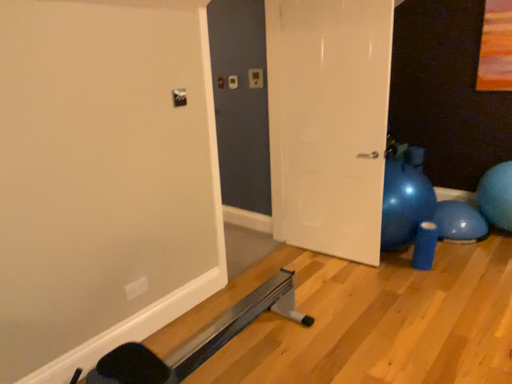
Question: Does blue rubber ball at right have a smaller size compared to white glossy door at center?

Choices:
 (A) yes
 (B) no

Answer: (A)

Question: Is blue rubber ball at right in front of white glossy door at center?

Choices:
 (A) no
 (B) yes

Answer: (A)

Question: From a real-world perspective, is blue rubber ball at right located beneath white glossy door at center?

Choices:
 (A) yes
 (B) no

Answer: (A)

Question: Is blue rubber ball at right aimed at white glossy door at center?

Choices:
 (A) yes
 (B) no

Answer: (B)

Question: From the image's perspective, would you say blue rubber ball at right is positioned over white glossy door at center?

Choices:
 (A) yes
 (B) no

Answer: (B)

Question: Considering the relative sizes of blue rubber ball at right and white glossy door at center in the image provided, is blue rubber ball at right bigger than white glossy door at center?

Choices:
 (A) yes
 (B) no

Answer: (B)

Question: Can you see white glossy door at center touching blue rubber ball at right?

Choices:
 (A) yes
 (B) no

Answer: (B)

Question: Is white glossy door at center shorter than blue rubber ball at right?

Choices:
 (A) yes
 (B) no

Answer: (B)

Question: Is white glossy door at center outside of blue rubber ball at right?

Choices:
 (A) no
 (B) yes

Answer: (B)

Question: Is white glossy door at center far from blue rubber ball at right?

Choices:
 (A) yes
 (B) no

Answer: (A)

Question: Can you confirm if white glossy door at center is wider than blue rubber ball at right?

Choices:
 (A) no
 (B) yes

Answer: (A)

Question: Is white glossy door at center facing towards blue rubber ball at right?

Choices:
 (A) no
 (B) yes

Answer: (A)

Question: Relative to blue rubber ball at right, is white glossy door at center in front or behind?

Choices:
 (A) behind
 (B) front

Answer: (B)